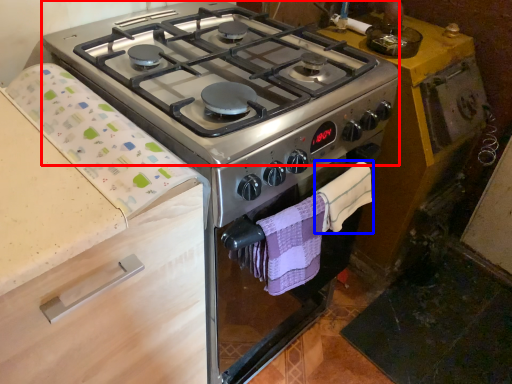
Question: Which object appears closest to the camera in this image, gas stove (highlighted by a red box) or hand towel (highlighted by a blue box)?

Choices:
 (A) gas stove
 (B) hand towel

Answer: (A)